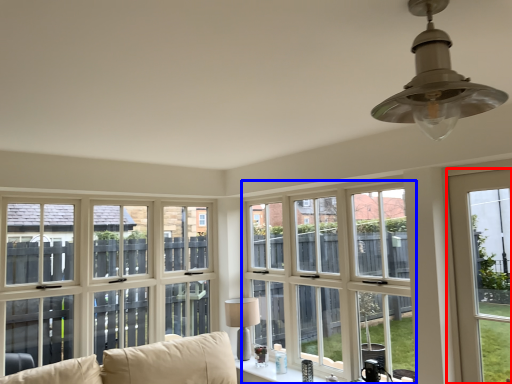
Question: Which of the following is the farthest to the observer, window (highlighted by a red box) or window (highlighted by a blue box)?

Choices:
 (A) window
 (B) window

Answer: (B)